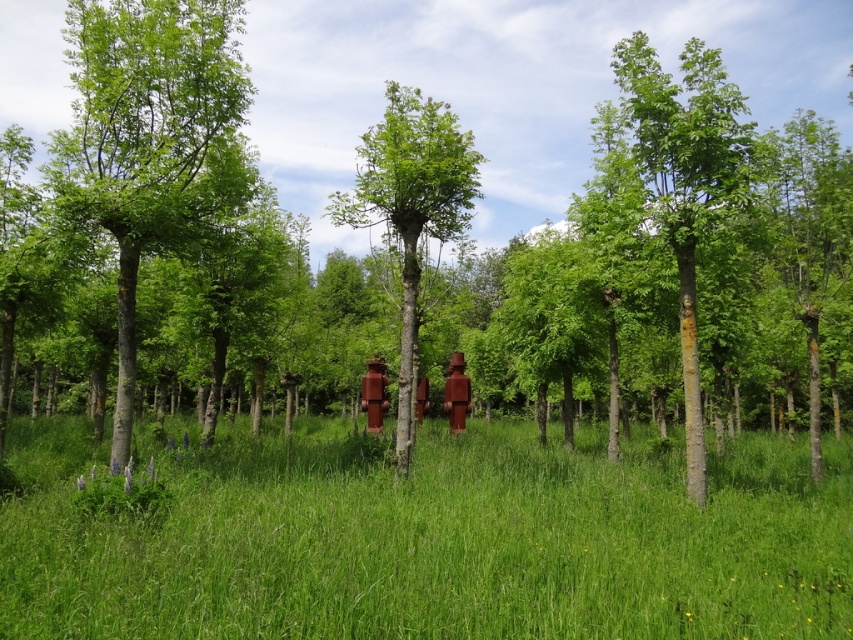
You are a hiker who wants to walk through the forest. You see a green smooth tree at left and a green smooth bark tree at center. Which tree is closer to you?

The green smooth tree at left is closer to you because it is positioned over the green smooth bark tree at center, meaning it is in front.

Looking at this image, you are a botanist examining two trees in the forest. You notice the green smooth bark tree at center and the green matte tree at center. Which of these two trees is smaller in size?

The green smooth bark tree at center is smaller in size compared to the green matte tree at center according to the description.

You are a hiker trying to identify two trees in the forest. You see the green smooth bark tree at center and the green matte tree at center. Which tree is shorter?

The green smooth bark tree at center is not as tall as the green matte tree at center, so the green smooth bark tree at center is shorter.